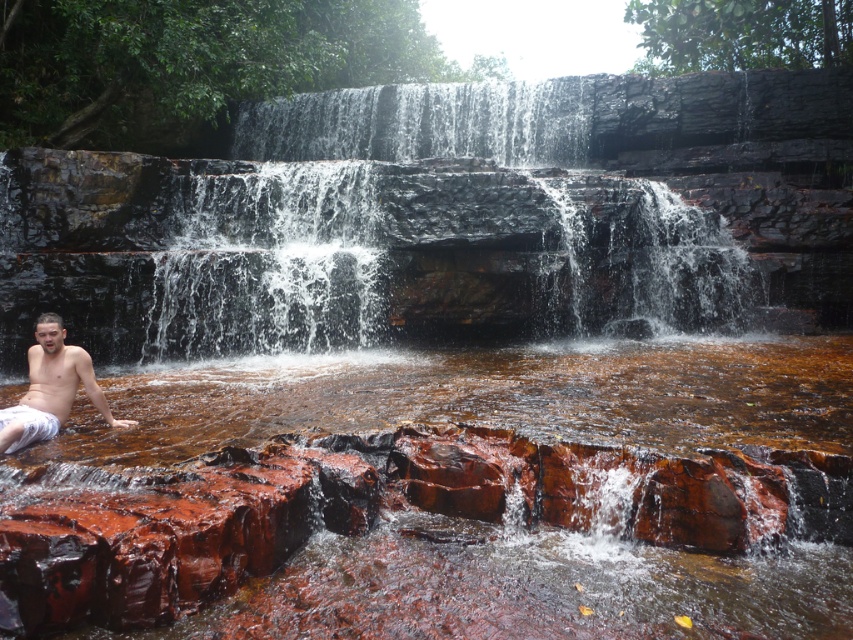
Is point (102, 449) more distant than point (381, 208)?

No, it is in front of (381, 208).

Is brown glossy water at center smaller than black stone waterfall at center?

Yes.

Between point (805, 625) and point (367, 208), which one is positioned in front?

Point (805, 625) is more forward.

At what (x,y) coordinates should I click in order to perform the action: click on brown glossy water at center. Please return your answer as a coordinate pair (x, y). The image size is (853, 640). Looking at the image, I should click on (461, 401).

Between black stone waterfall at center and shiny white shorts at lower left, which one is positioned higher?

black stone waterfall at center

Who is more distant from viewer, (x=367, y=188) or (x=78, y=358)?

The point (x=367, y=188) is behind.

The width and height of the screenshot is (853, 640). I want to click on black stone waterfall at center, so click(428, 228).

Who is positioned more to the left, brown glossy water at center or shiny white shorts at lower left?

From the viewer's perspective, shiny white shorts at lower left appears more on the left side.

Does brown glossy water at center appear on the right side of shiny white shorts at lower left?

Yes, brown glossy water at center is to the right of shiny white shorts at lower left.

Is point (496, 396) positioned after point (27, 444)?

Yes, point (496, 396) is farther from viewer.

Where is `brown glossy water at center`? The width and height of the screenshot is (853, 640). brown glossy water at center is located at coordinates (461, 401).